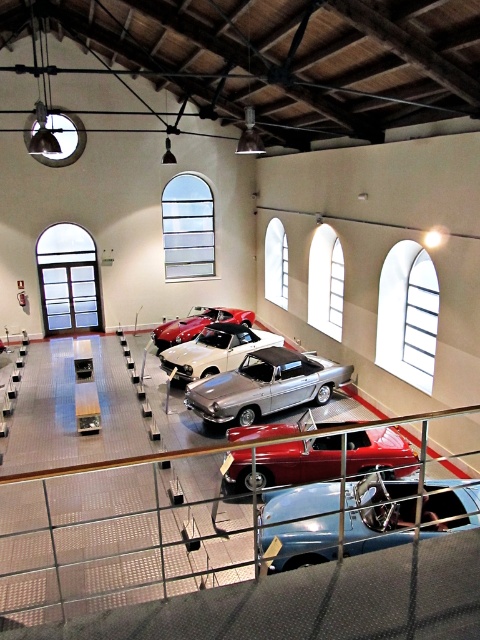
You are a visitor in the car museum and want to take a photo of both the shiny blue convertible at center and the silver metallic car at center. Which car should you stand closer to in order to capture both in a single frame without moving your camera position?

You should stand closer to the shiny blue convertible at center because it is shorter than the silver metallic car at center, allowing both to fit within the camera frame more easily.

You are a delivery robot with a 4 meter long package. You need to transport this package from the entrance to the storage area behind the shiny blue convertible at center and silver metallic car at center. Can you navigate through the space between these two vehicles?

The distance between the shiny blue convertible at center and the silver metallic car at center is 3.99 meters. Since the package is 4 meters long, it is slightly longer than the available space. Therefore, the delivery robot cannot safely navigate through the space between these two vehicles with the 4 meter long package.

You are a visitor in the car museum and want to take a photo of both the silver metallic car at center and the shiny red convertible at center. Since you have a wide angle lens, can you capture both cars in the same frame without moving your camera position?

The silver metallic car at center is in front of the shiny red convertible at center, so if you position yourself so that both are in your field of view, the wide angle lens should allow you to capture both cars in the same frame as long as they are within the lens range.